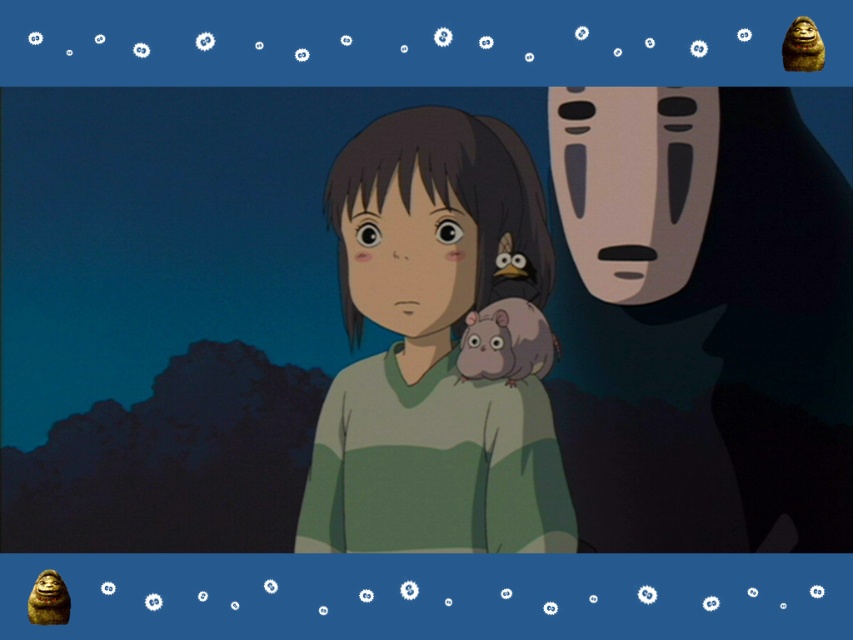
You are a character in the scene and need to decide which object to grab first. The smooth green sweater at center and the shiny golden statue at bottom left are both within reach. Which one is larger?

The smooth green sweater at center is bigger than the shiny golden statue at bottom left, so you should grab the smooth green sweater at center first.

You are a fashion designer observing the scene. You need to decide which item has a greater horizontal span between the smooth green sweater at center and the brown furry monkey at upper right. Which one is wider?

The smooth green sweater at center has a greater horizontal span than the brown furry monkey at upper right because its width surpasses the monkey.